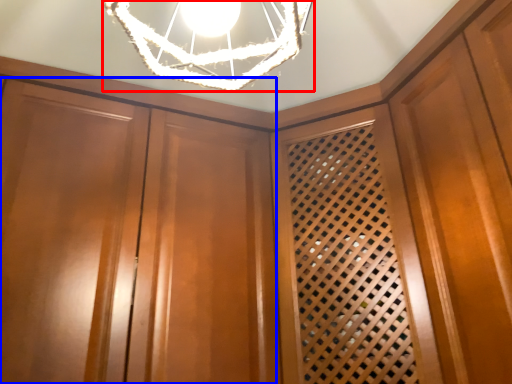
Question: Which of the following is the farthest to the observer, lamp (highlighted by a red box) or cabinetry (highlighted by a blue box)?

Choices:
 (A) lamp
 (B) cabinetry

Answer: (B)